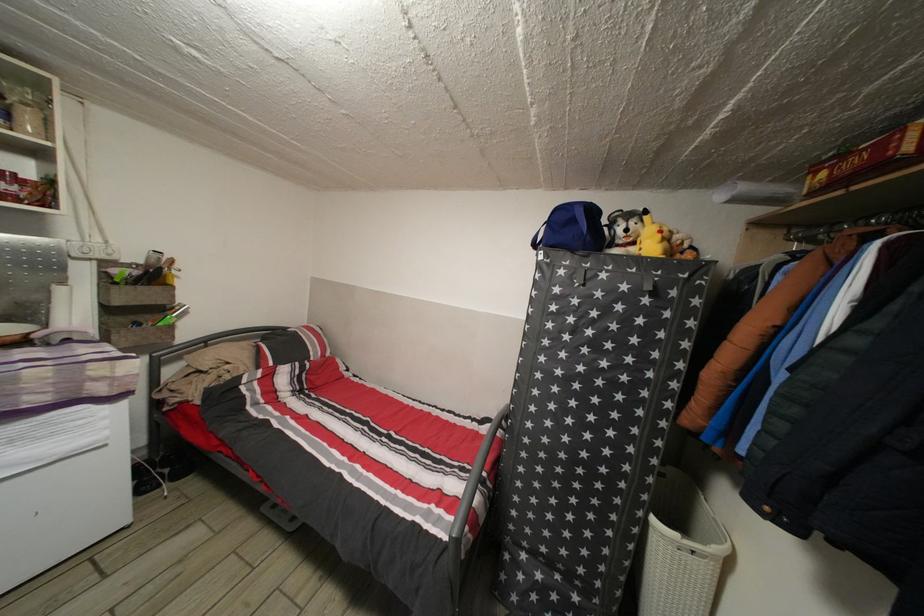
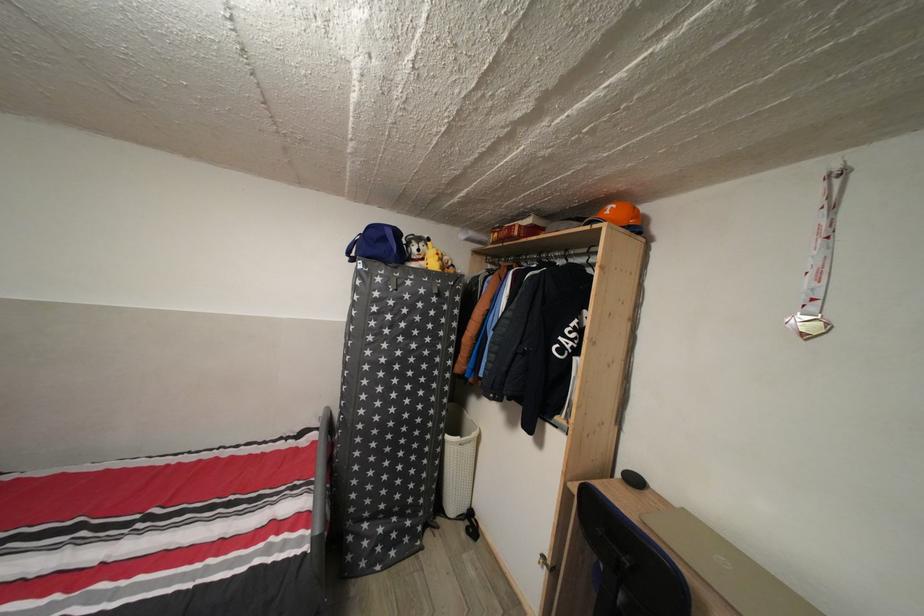
The point at (546, 476) is marked in the first image. Where is the corresponding point in the second image?

(380, 451)